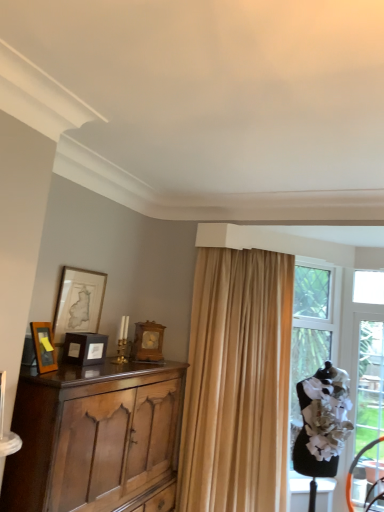
Question: Is matte black picture frame at center, which is the third picture frame from back to front, not within beige fabric curtain at center?

Choices:
 (A) yes
 (B) no

Answer: (A)

Question: Considering the relative sizes of matte black picture frame at center, which is the third picture frame from back to front, and beige fabric curtain at center in the image provided, is matte black picture frame at center, which is the third picture frame from back to front, taller than beige fabric curtain at center?

Choices:
 (A) no
 (B) yes

Answer: (A)

Question: Does matte black picture frame at center, which is the third picture frame from back to front, have a lesser width compared to beige fabric curtain at center?

Choices:
 (A) no
 (B) yes

Answer: (B)

Question: Is matte black picture frame at center, which ranks as the 2th picture frame in front-to-back order, oriented away from beige fabric curtain at center?

Choices:
 (A) yes
 (B) no

Answer: (B)

Question: Is matte black picture frame at center, which ranks as the 2th picture frame in front-to-back order, wider than beige fabric curtain at center?

Choices:
 (A) no
 (B) yes

Answer: (A)

Question: Is beige fabric curtain at center located within matte black picture frame at center, which is the third picture frame from back to front?

Choices:
 (A) no
 (B) yes

Answer: (A)

Question: From the image's perspective, is beige fabric curtain at center located above clear glass door at right?

Choices:
 (A) yes
 (B) no

Answer: (A)

Question: Are beige fabric curtain at center and clear glass door at right located far from each other?

Choices:
 (A) yes
 (B) no

Answer: (A)

Question: Is beige fabric curtain at center shorter than clear glass door at right?

Choices:
 (A) no
 (B) yes

Answer: (A)

Question: Can you confirm if beige fabric curtain at center is positioned to the right of clear glass door at right?

Choices:
 (A) no
 (B) yes

Answer: (A)

Question: Can you confirm if beige fabric curtain at center is taller than clear glass door at right?

Choices:
 (A) yes
 (B) no

Answer: (A)

Question: Is beige fabric curtain at center closer to the viewer compared to clear glass door at right?

Choices:
 (A) no
 (B) yes

Answer: (B)

Question: Is polished wood cabinet at left closer to camera compared to matte gold picture frame at upper left, the third picture frame viewed from the front?

Choices:
 (A) yes
 (B) no

Answer: (A)